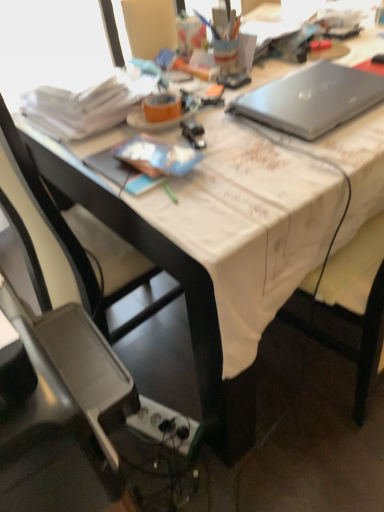
This screenshot has height=512, width=384. I want to click on vacant region to the left of silver metallic laptop at upper right, so click(225, 126).